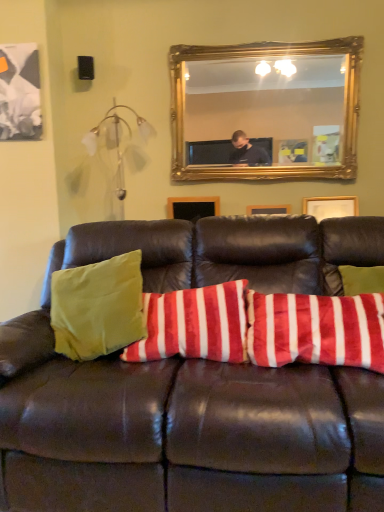
Question: Would you say leather couch at center is outside velvety red and white striped pillow at center?

Choices:
 (A) no
 (B) yes

Answer: (B)

Question: Can you confirm if leather couch at center is wider than velvety red and white striped pillow at center?

Choices:
 (A) yes
 (B) no

Answer: (A)

Question: Considering the relative positions of leather couch at center and velvety red and white striped pillow at center in the image provided, is leather couch at center to the left of velvety red and white striped pillow at center from the viewer's perspective?

Choices:
 (A) yes
 (B) no

Answer: (B)

Question: From the image's perspective, does leather couch at center appear lower than velvety red and white striped pillow at center?

Choices:
 (A) yes
 (B) no

Answer: (A)

Question: From the image's perspective, is leather couch at center on velvety red and white striped pillow at center?

Choices:
 (A) no
 (B) yes

Answer: (A)

Question: Is leather couch at center further to the viewer compared to velvety red and white striped pillow at center?

Choices:
 (A) yes
 (B) no

Answer: (B)

Question: Is velvety red and white striped pillow at center not near gold-framed mirror at upper center?

Choices:
 (A) yes
 (B) no

Answer: (A)

Question: Is gold-framed mirror at upper center located within velvety red and white striped pillow at center?

Choices:
 (A) no
 (B) yes

Answer: (A)

Question: From a real-world perspective, is velvety red and white striped pillow at center under gold-framed mirror at upper center?

Choices:
 (A) yes
 (B) no

Answer: (A)

Question: Is velvety red and white striped pillow at center oriented away from gold-framed mirror at upper center?

Choices:
 (A) no
 (B) yes

Answer: (A)

Question: Does velvety red and white striped pillow at center have a larger size compared to gold-framed mirror at upper center?

Choices:
 (A) no
 (B) yes

Answer: (A)

Question: Is velvety red and white striped pillow at center shorter than gold-framed mirror at upper center?

Choices:
 (A) yes
 (B) no

Answer: (A)

Question: Is gold-framed mirror at upper center bigger than velvety red and white striped pillow at center?

Choices:
 (A) no
 (B) yes

Answer: (B)